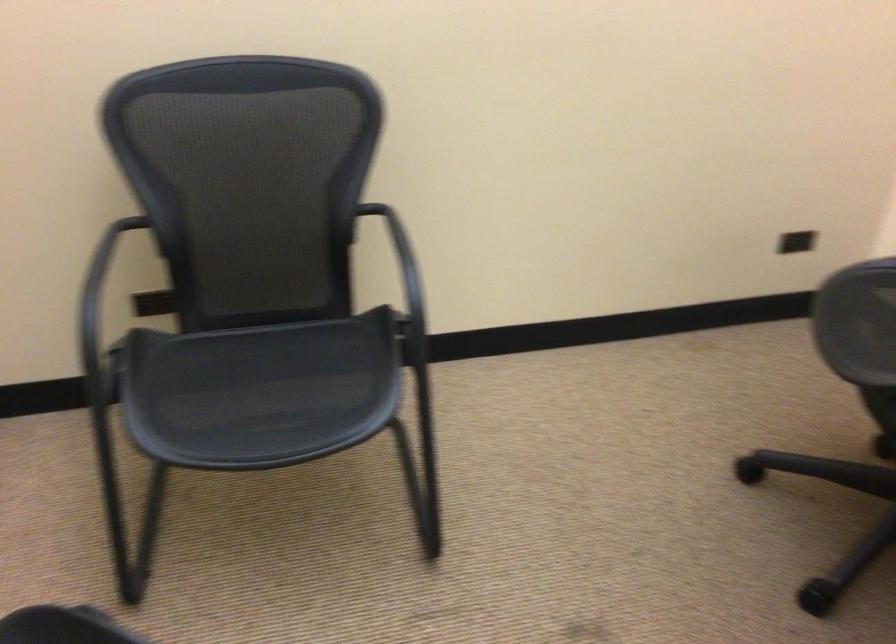
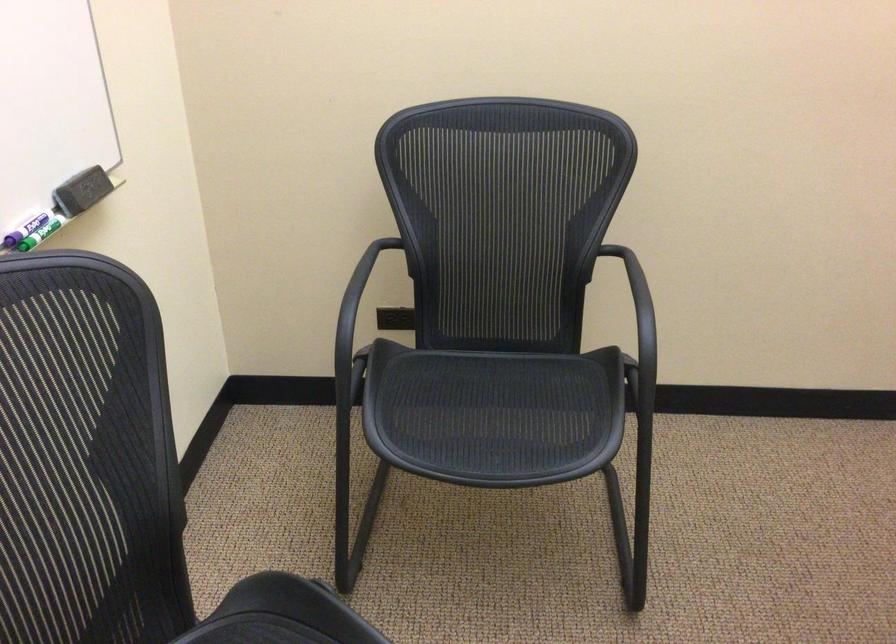
Where in the second image is the point corresponding to point 256,393 from the first image?

(478, 413)